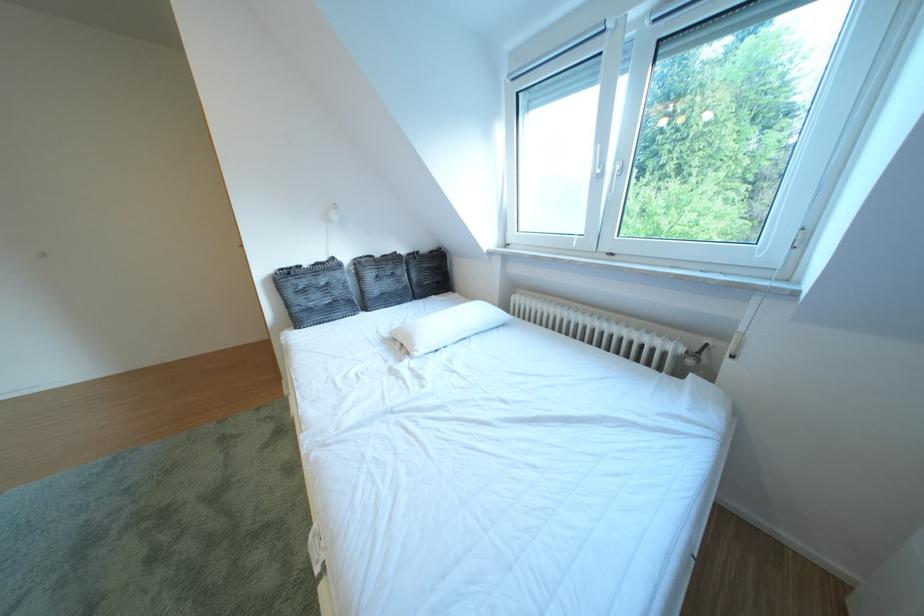
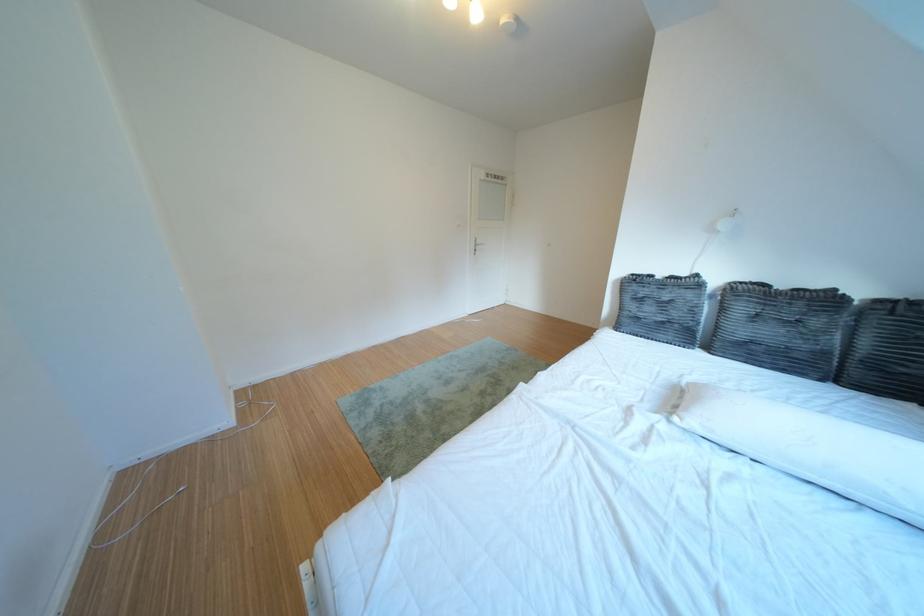
Where in the second image is the point corresponding to point (310, 314) from the first image?

(639, 318)